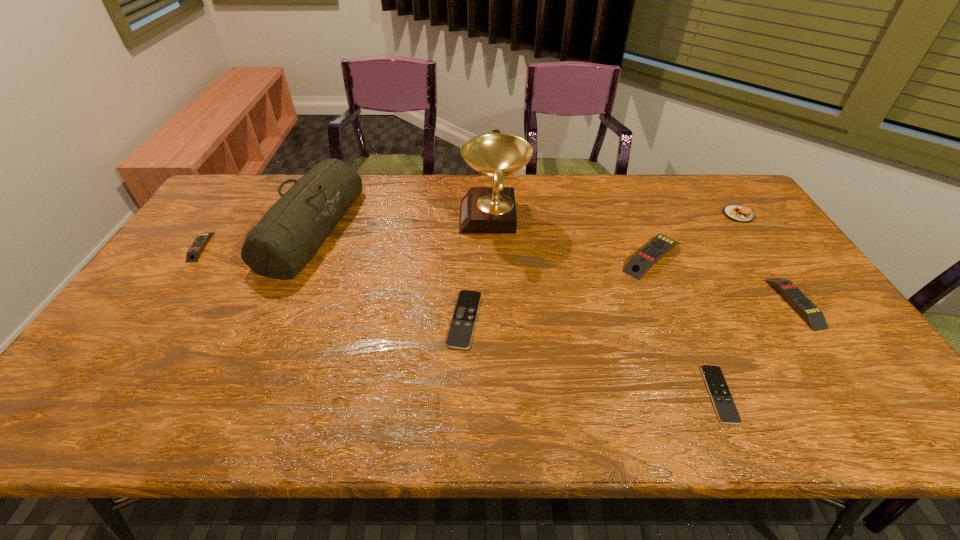
Identify the location of the tallest object. This screenshot has height=540, width=960. (484, 210).

The width and height of the screenshot is (960, 540). Identify the location of duffel bag. (291, 232).

In order to click on the second object from left to right in this screenshot , I will do `click(291, 232)`.

This screenshot has width=960, height=540. I want to click on patty, so click(x=737, y=213).

Find the location of a particular element. This screenshot has height=540, width=960. the biggest yellow remote control is located at coordinates (651, 253).

The height and width of the screenshot is (540, 960). I want to click on the fifth shortest object, so 651,253.

At what (x,y) coordinates should I click in order to perform the action: click on the rightmost remote control. Please return your answer as a coordinate pair (x, y). The height and width of the screenshot is (540, 960). Looking at the image, I should click on (814, 317).

Image resolution: width=960 pixels, height=540 pixels. Identify the location of the fourth shortest object. (814, 317).

Image resolution: width=960 pixels, height=540 pixels. I want to click on the smallest yellow remote control, so 193,254.

Find the location of a particular element. the leftmost yellow remote control is located at coordinates (193, 254).